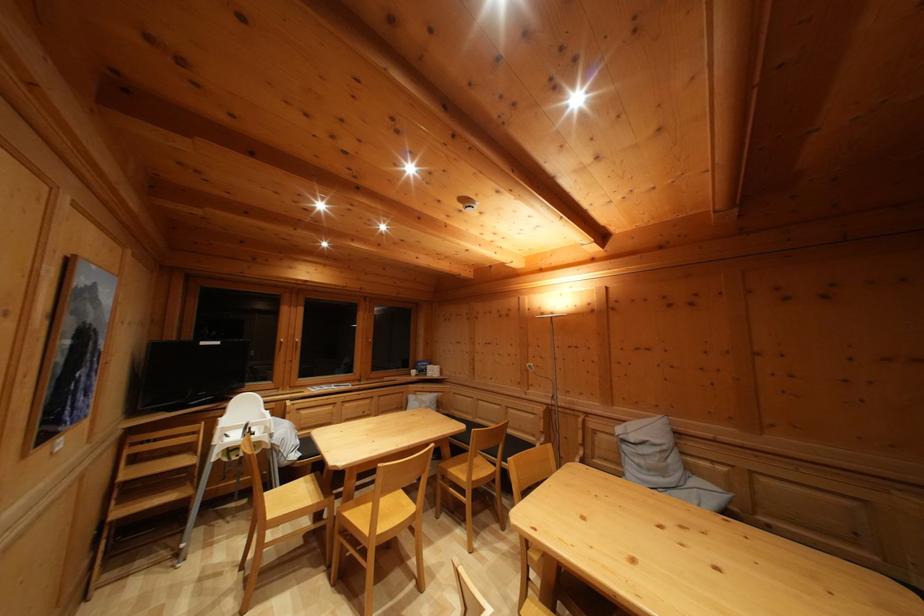
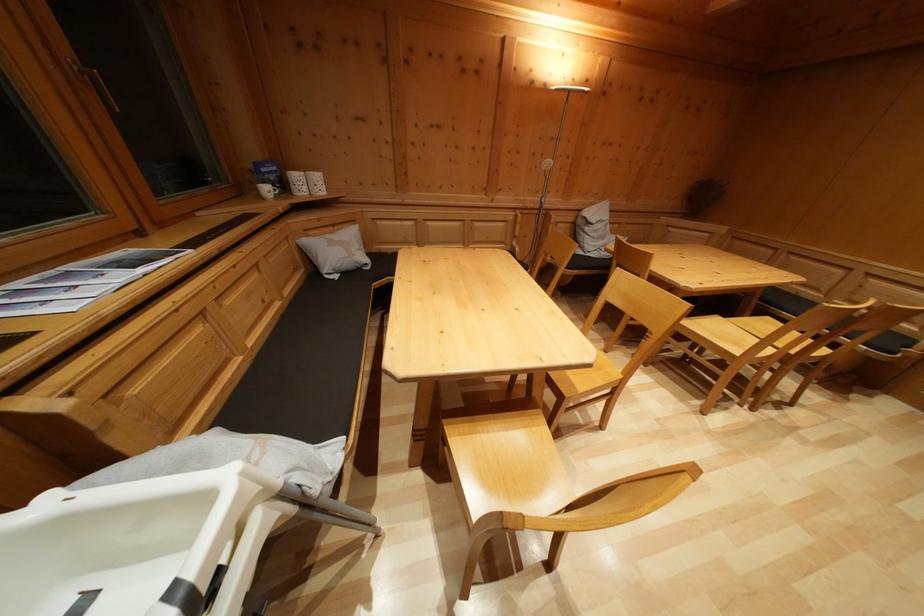
Find the pixel in the second image that matches [419,379] in the first image.

(273, 197)